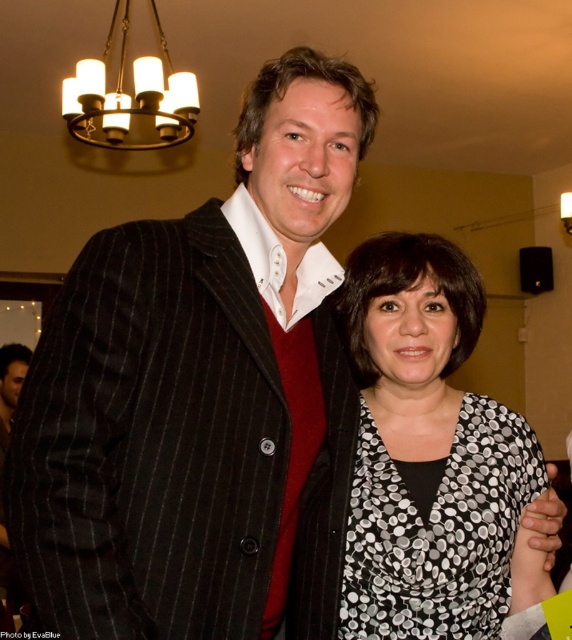
Does black pinstripe suit at center have a greater height compared to gold metallic chandelier at upper left?

No, black pinstripe suit at center is not taller than gold metallic chandelier at upper left.

Can you confirm if black pinstripe suit at center is smaller than gold metallic chandelier at upper left?

Correct, black pinstripe suit at center occupies less space than gold metallic chandelier at upper left.

Is point (121, 362) positioned before point (188, 122)?

Yes, point (121, 362) is in front of point (188, 122).

This screenshot has height=640, width=572. I want to click on black pinstripe suit at center, so click(x=144, y=438).

Can you confirm if black pinstripe suit at center is wider than black dotted blouse at center?

Yes, black pinstripe suit at center is wider than black dotted blouse at center.

Based on the photo, between black pinstripe suit at center and black dotted blouse at center, which one appears on the right side from the viewer's perspective?

black dotted blouse at center is more to the right.

Which is in front, point (261, 465) or point (462, 420)?

Point (261, 465) is more forward.

The width and height of the screenshot is (572, 640). I want to click on black pinstripe suit at center, so click(x=144, y=438).

Does black dotted blouse at center appear under gold metallic chandelier at upper left?

Indeed, black dotted blouse at center is positioned under gold metallic chandelier at upper left.

Between black dotted blouse at center and gold metallic chandelier at upper left, which one has more height?

With more height is gold metallic chandelier at upper left.

Where is `black dotted blouse at center`? The width and height of the screenshot is (572, 640). black dotted blouse at center is located at coordinates (427, 451).